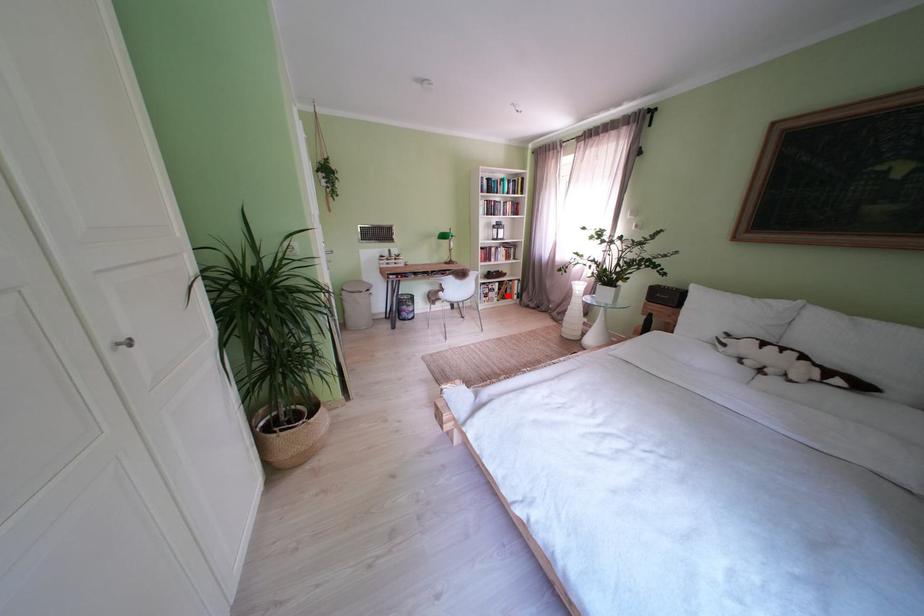
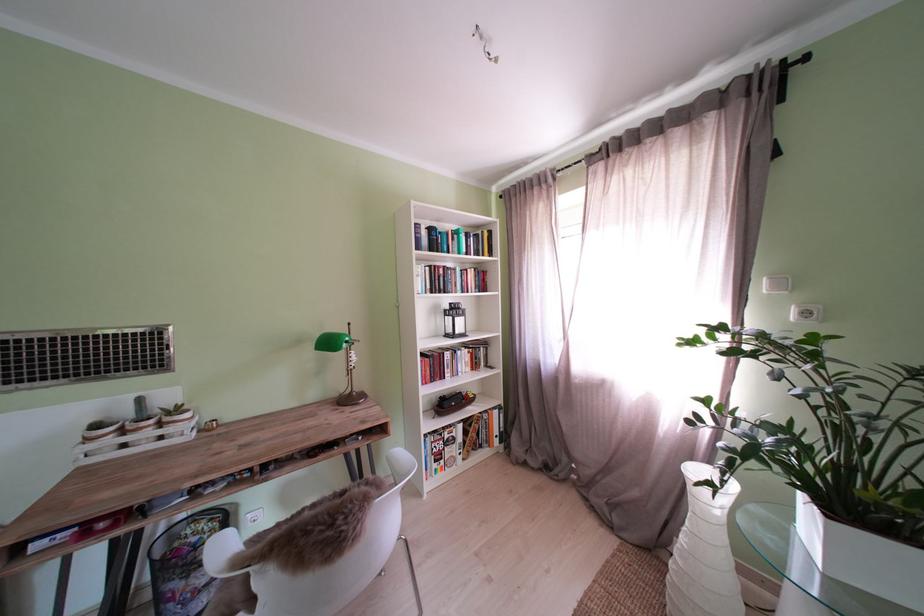
The point at the highlighted location is marked in the first image. Where is the corresponding point in the second image?

(470, 444)